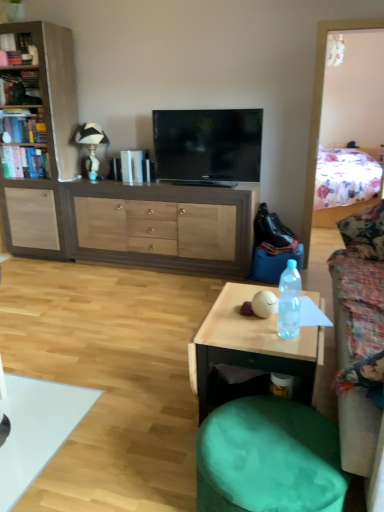
This screenshot has height=512, width=384. In order to click on vacant area situated to the left side of green fabric swivel chair at lower right in this screenshot , I will do `click(141, 467)`.